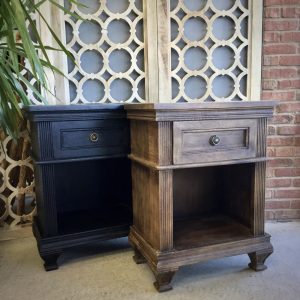
Image resolution: width=300 pixels, height=300 pixels. What are the coordinates of `knob` in the screenshot? It's located at (214, 140).